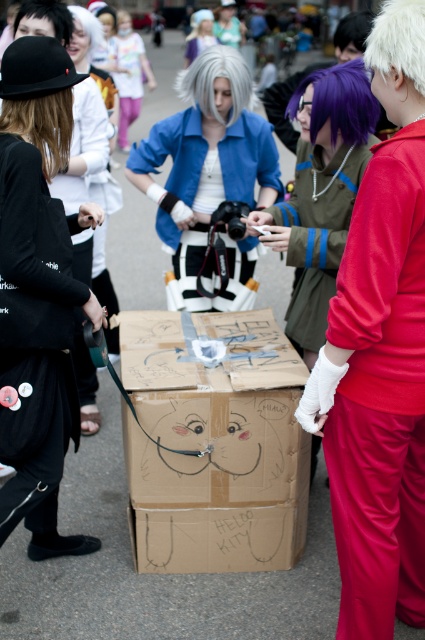
You are at the cosplay event and want to move from the point at coordinates point [314,296] to the point at coordinates point [164,212]. Which direction should you move in to get there?

To move from point [314,296] to point [164,212], you should move towards the left and downward since point [164,212] is behind point [314,296].

You are a photographer at the event and want to take a photo of the matte green jacket at center and the purple hair at center. Based on their positions, which object should you focus on first to ensure both are in frame?

The matte green jacket at center is to the left of purple hair at center, so you should focus on the matte green jacket at center first to ensure both are in frame.

You are a photographer at the event. You want to capture a photo where the velvet red pants at right and the matte green jacket at center are both visible. Based on their positions, which one should you ensure is closer to the camera to include both in the frame?

The velvet red pants at right is below the matte green jacket at center. To include both in the frame, you should ensure the matte green jacket at center is closer to the camera so that the velvet red pants at right, being lower, can still be captured without being cropped out.